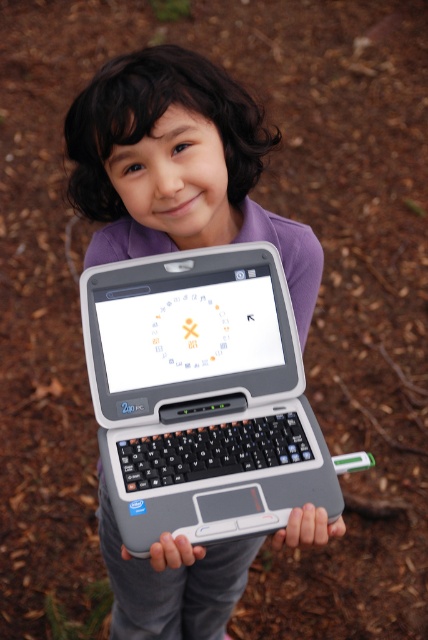
Question: Is gray plastic laptop at center wider than matte gray laptop at center?

Choices:
 (A) yes
 (B) no

Answer: (A)

Question: Does gray plastic laptop at center appear under matte gray laptop at center?

Choices:
 (A) no
 (B) yes

Answer: (A)

Question: Which point appears farthest from the camera in this image?

Choices:
 (A) (172, 550)
 (B) (246, 244)
 (C) (308, 525)

Answer: (B)

Question: Can you confirm if gray plastic laptop at center is positioned below matte gray laptop at center?

Choices:
 (A) yes
 (B) no

Answer: (B)

Question: Which point is closer to the camera?

Choices:
 (A) (178, 566)
 (B) (207, 285)

Answer: (A)

Question: Based on their relative distances, which object is nearer to the gray matte laptop at center?

Choices:
 (A) matte gray laptop at center
 (B) gray plastic laptop at center

Answer: (A)